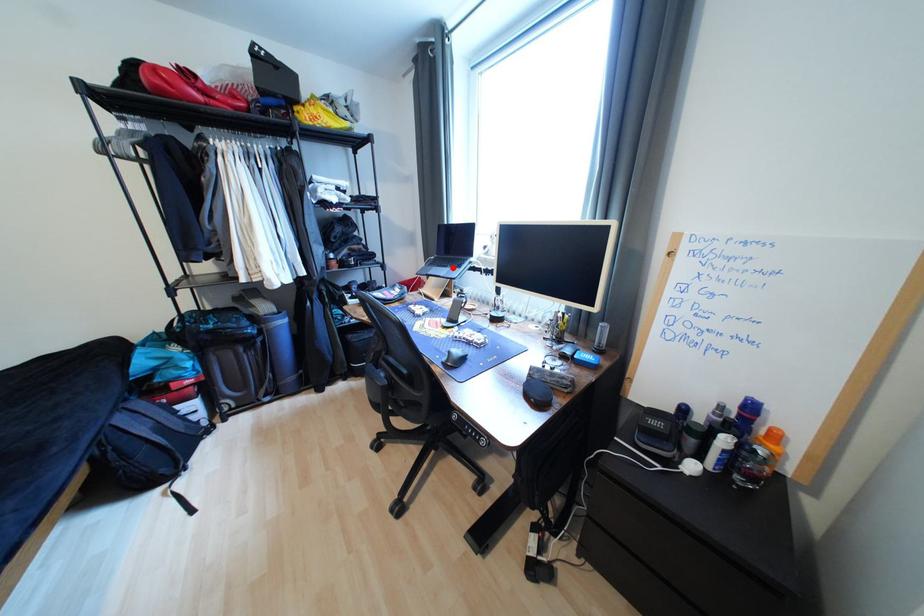
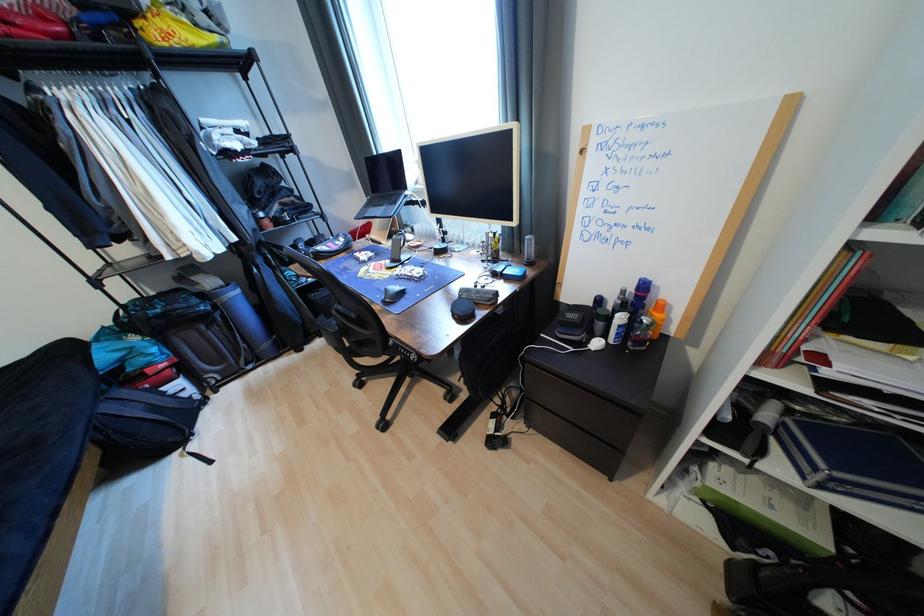
The point at the highlighted location is marked in the first image. Where is the corresponding point in the second image?

(388, 207)